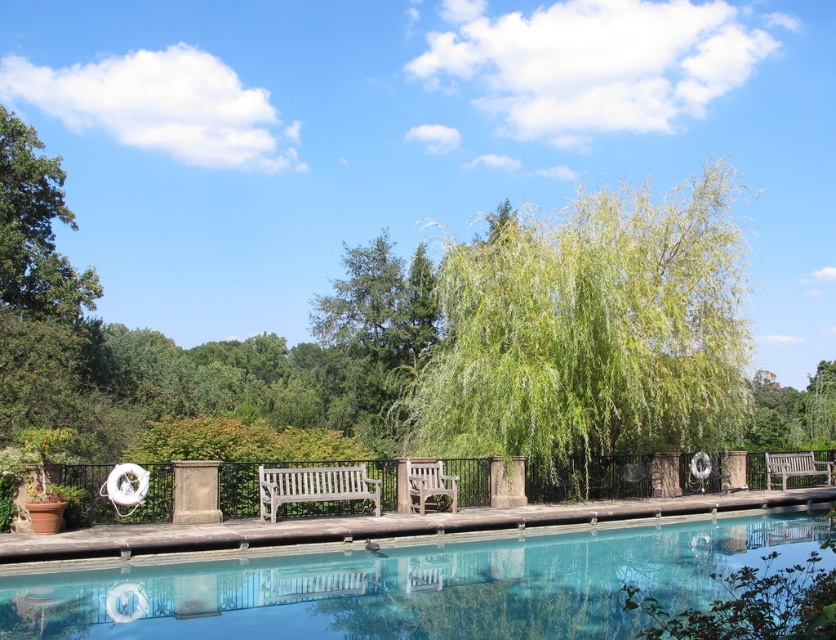
Is green leafy willow at center shorter than light brown wooden bench at right?

In fact, green leafy willow at center may be taller than light brown wooden bench at right.

What are the coordinates of `green leafy willow at center` in the screenshot? It's located at (592, 330).

Can you confirm if green leafy willow at center is positioned to the right of clear glass pool at center?

Indeed, green leafy willow at center is positioned on the right side of clear glass pool at center.

Between green leafy willow at center and clear glass pool at center, which one appears on the left side from the viewer's perspective?

Positioned to the left is clear glass pool at center.

Does point (730, 275) lie behind point (580, 582)?

Yes, point (730, 275) is behind point (580, 582).

Locate an element on the screen. green leafy willow at center is located at coordinates (592, 330).

Between clear glass pool at center and wooden park bench at center, which one is positioned higher?

wooden park bench at center is above.

Is clear glass pool at center to the right of wooden park bench at center from the viewer's perspective?

Indeed, clear glass pool at center is positioned on the right side of wooden park bench at center.

I want to click on clear glass pool at center, so click(x=410, y=586).